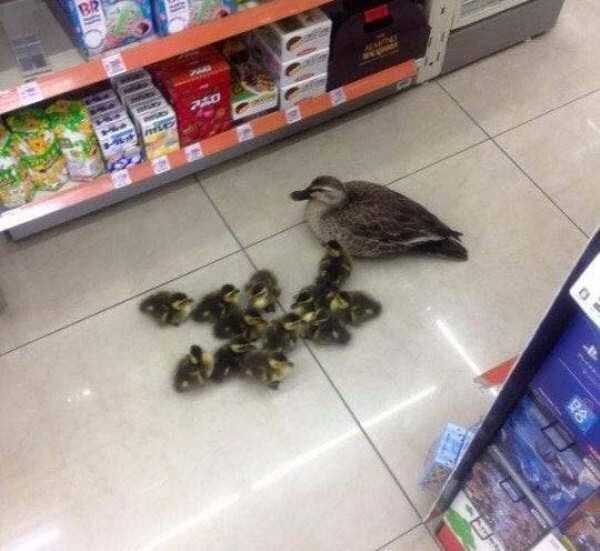
I want to click on tile, so coord(167,126).